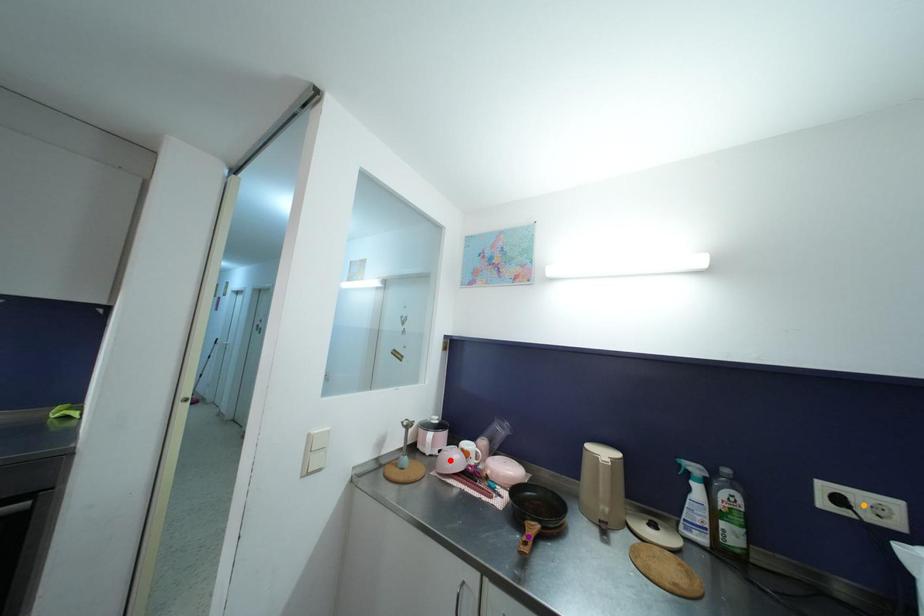
Order these from farthest to nearest:
A) orange point
B) purple point
C) red point

red point < purple point < orange point